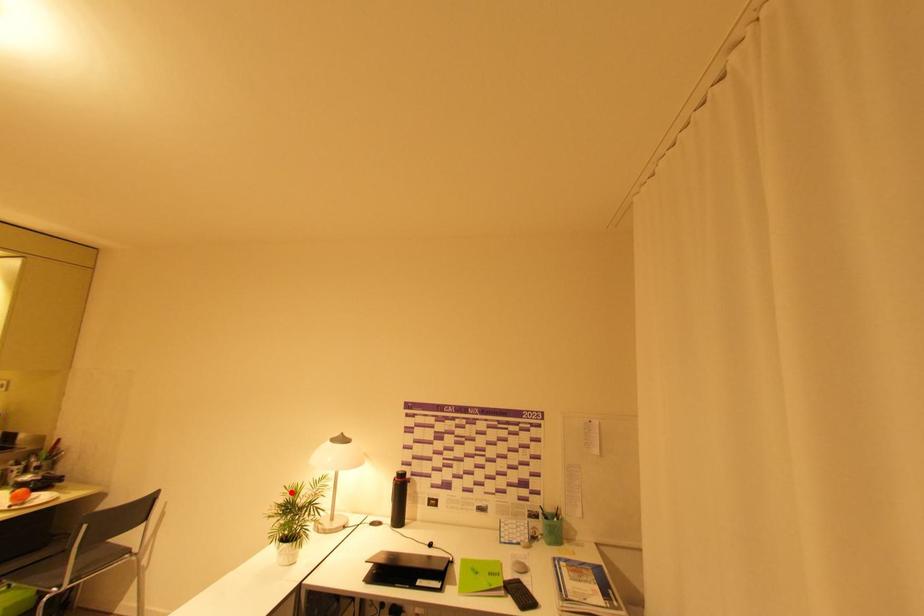
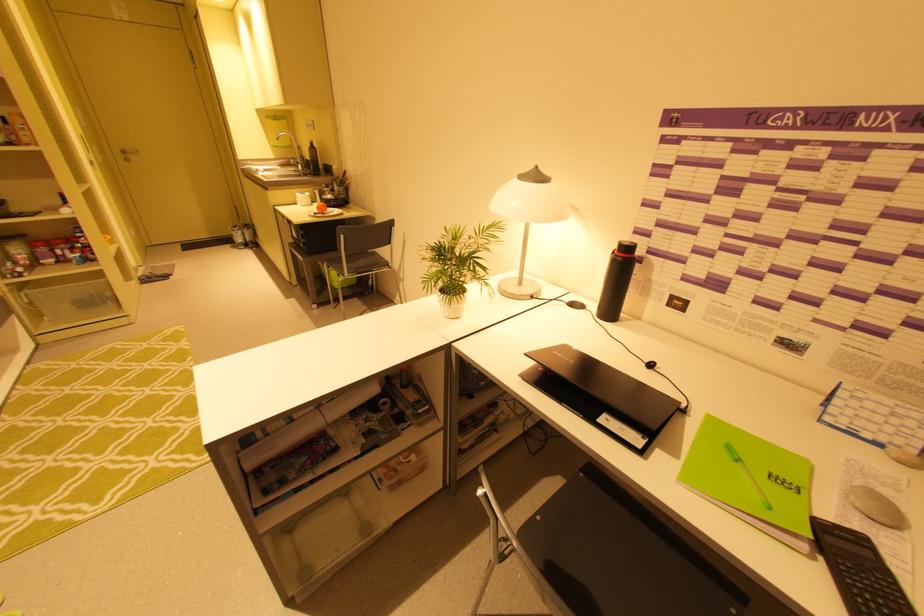
In the second image, find the point that corresponds to the highlighted location in the first image.

(451, 235)